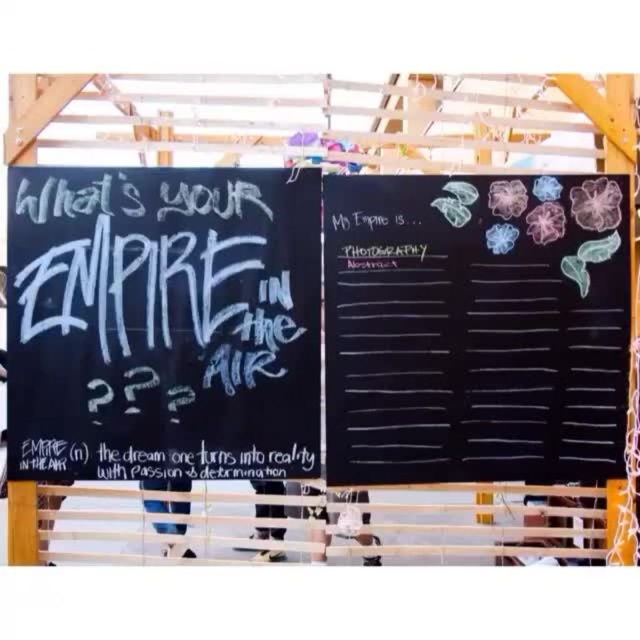
You are an artist who wants to write a long message on the white chalkboard at left and a shorter message on the white chalkboard at center. Which board will have more vertical space remaining after writing your messages?

The white chalkboard at center will have more vertical space remaining because it is taller than the white chalkboard at left, and you are writing a longer message on the shorter board.

You are standing in front of the two chalkboard panels. The point marked at coordinates (163, 323) is part of which chalkboard panel?

The point marked at coordinates (163, 323) is part of the white chalkboard at left.

You are at an outdoor event and want to take a photo of both the white chalkboard at left and the white chalkboard at center. Which chalkboard should you position yourself closer to in order to capture both in a single frame?

You should position yourself closer to the white chalkboard at center because the white chalkboard at left is above it, so adjusting your angle downward will allow both to be in the frame.